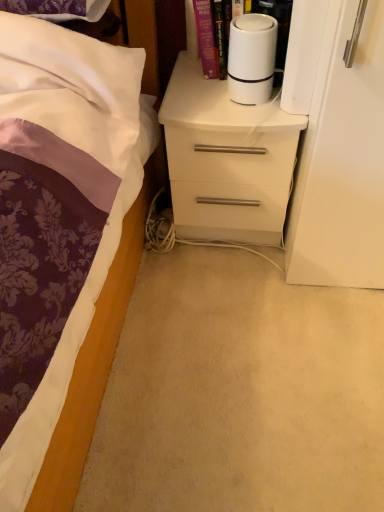
At what (x,y) coordinates should I click in order to perform the action: click on free space that is to the left of white matte cylindrical object at upper center. Please return your answer as a coordinate pair (x, y). Image resolution: width=384 pixels, height=512 pixels. Looking at the image, I should click on (194, 103).